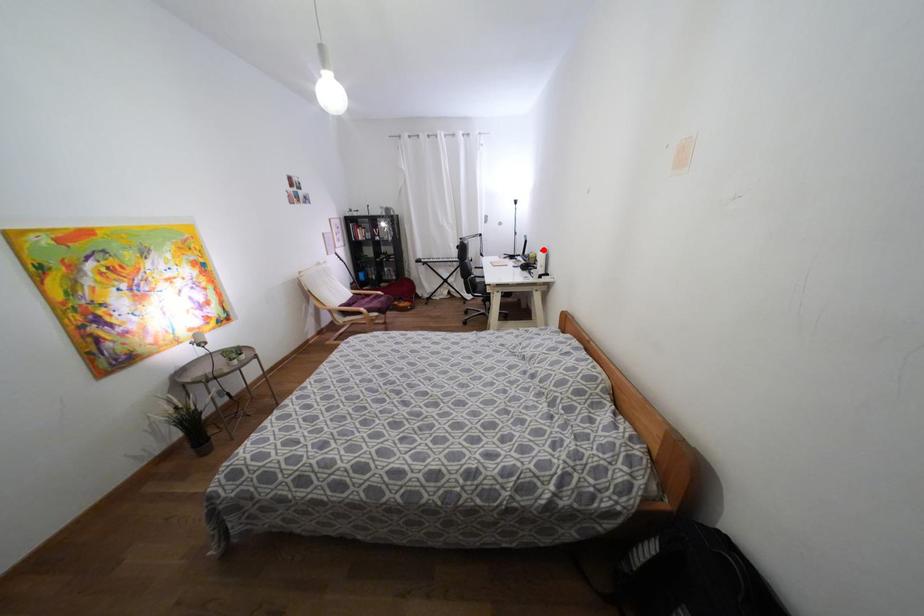
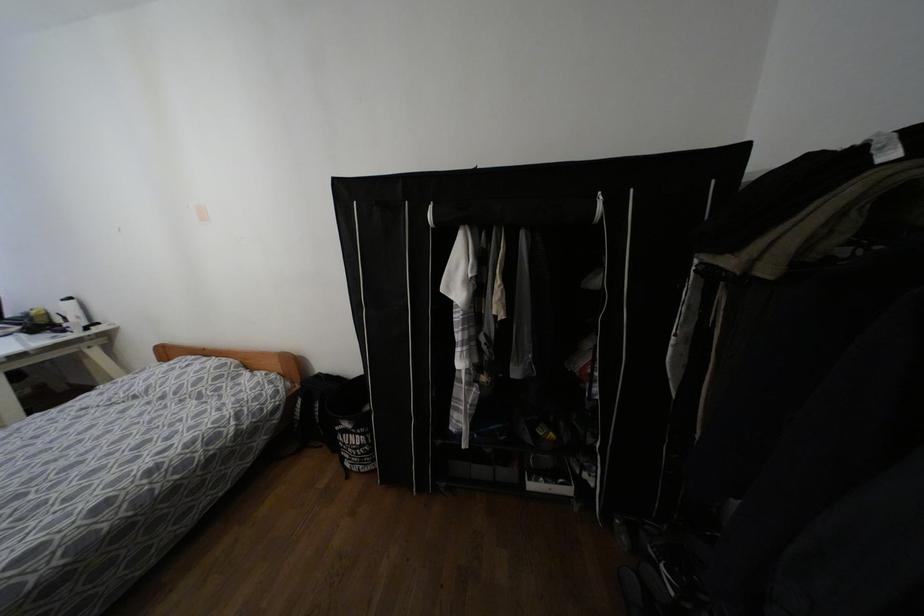
Question: I am providing you with two images of the same scene from different viewpoints. In image1, a red point is highlighted. Considering the same 3D point in image2, which of the following is correct?

Choices:
 (A) It is closer
 (B) It is farther

Answer: (B)